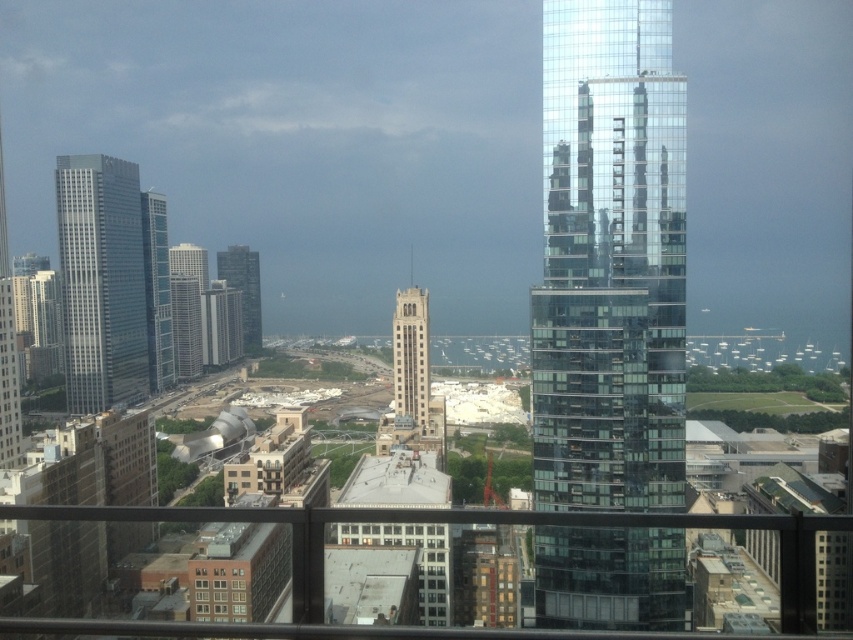
Which is behind, point (151, 353) or point (178, 276)?

The point (151, 353) is behind.

Find the location of a particular element. glassy reflective skyscraper at left is located at coordinates (157, 291).

Between matte glass skyscraper at center-left and matte silver skyscraper at center-left, which one is positioned lower?

Answer: matte glass skyscraper at center-left is lower down.

Is matte glass skyscraper at center-left further to the viewer compared to matte silver skyscraper at center-left?

Yes, it is behind matte silver skyscraper at center-left.

Does point (175, 371) come in front of point (177, 259)?

That is True.

Where is `matte glass skyscraper at center-left`? matte glass skyscraper at center-left is located at coordinates (184, 324).

Is point (160, 260) positioned after point (184, 248)?

Yes, it is.

Between glassy reflective skyscraper at left and matte silver skyscraper at center-left, which one has less height?

matte silver skyscraper at center-left

Locate an element on the screen. This screenshot has height=640, width=853. glassy reflective skyscraper at left is located at coordinates (157, 291).